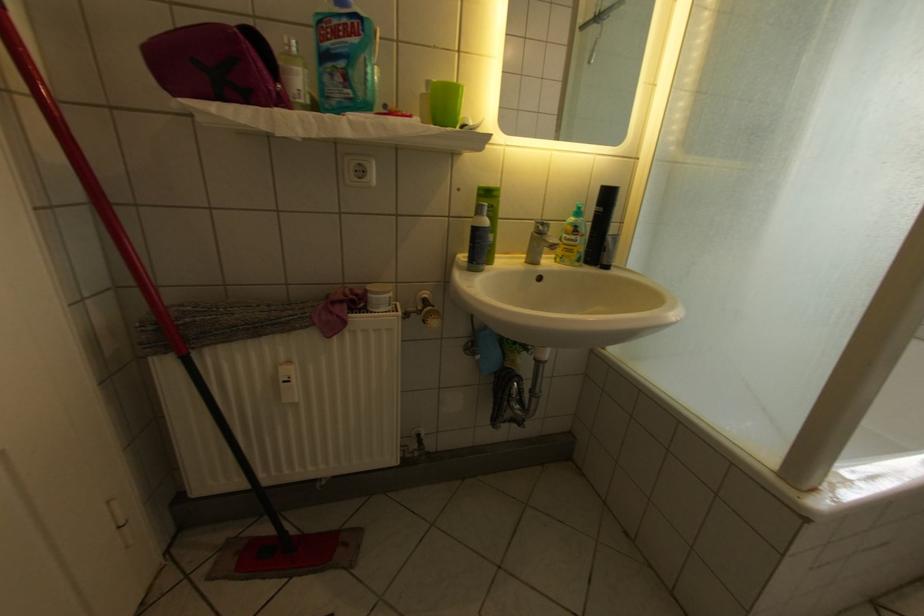
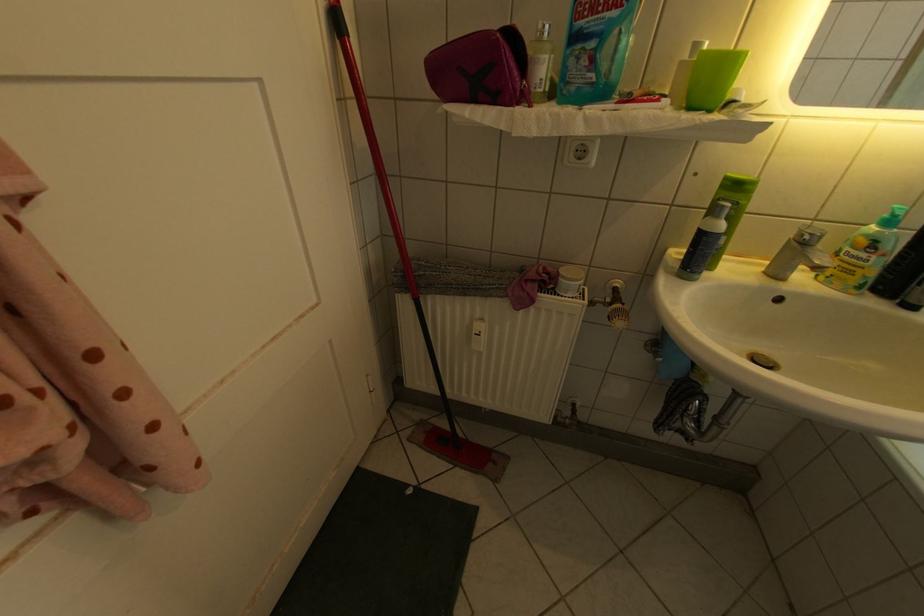
In the second image, find the point that corresponds to point (374, 306) in the first image.

(564, 286)